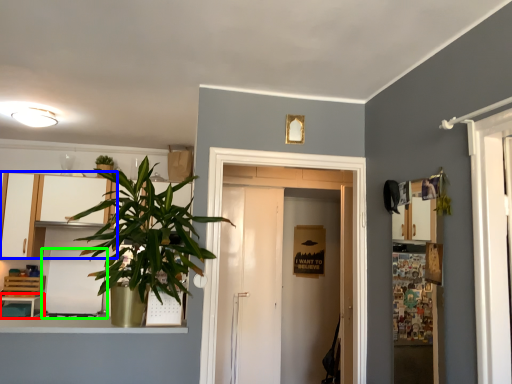
Question: Which object is positioned closest to table (highlighted by a red box)? Select from cabinetry (highlighted by a blue box) and appliance (highlighted by a green box).

Choices:
 (A) cabinetry
 (B) appliance

Answer: (B)